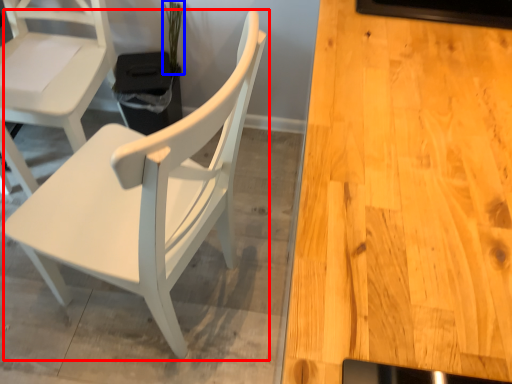
Question: Which point is closer to the camera, chair (highlighted by a red box) or plant (highlighted by a blue box)?

Choices:
 (A) chair
 (B) plant

Answer: (A)